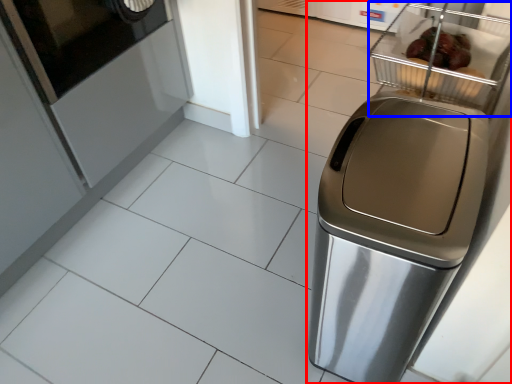
Question: Among these objects, which one is farthest to the camera, home appliance (highlighted by a red box) or basket (highlighted by a blue box)?

Choices:
 (A) home appliance
 (B) basket

Answer: (B)